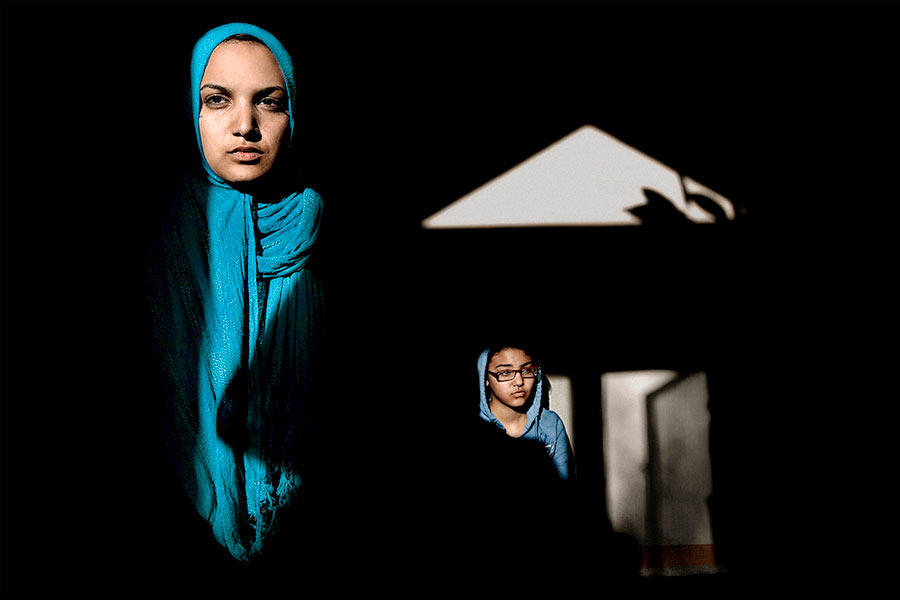
The height and width of the screenshot is (600, 900). I want to click on doorway, so coord(654,485).